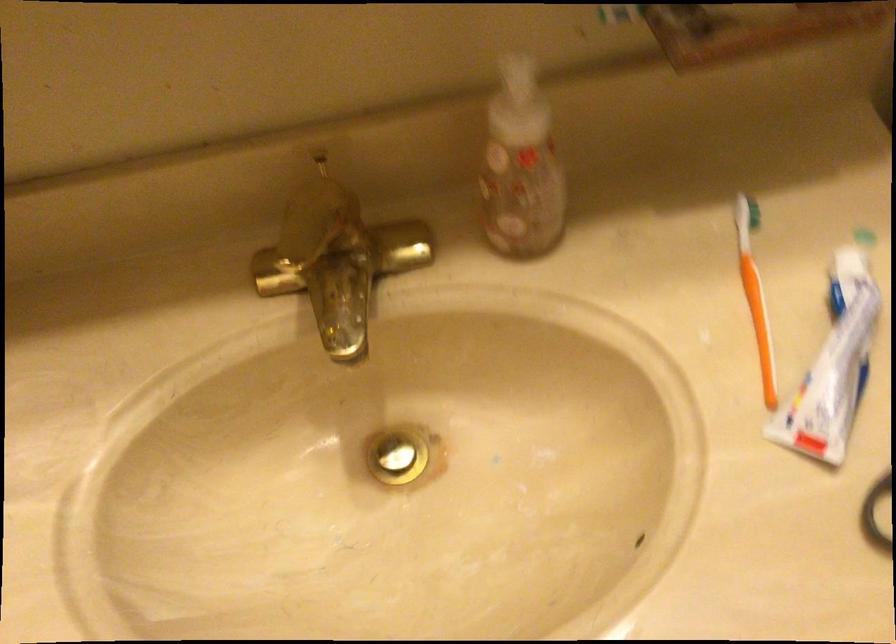
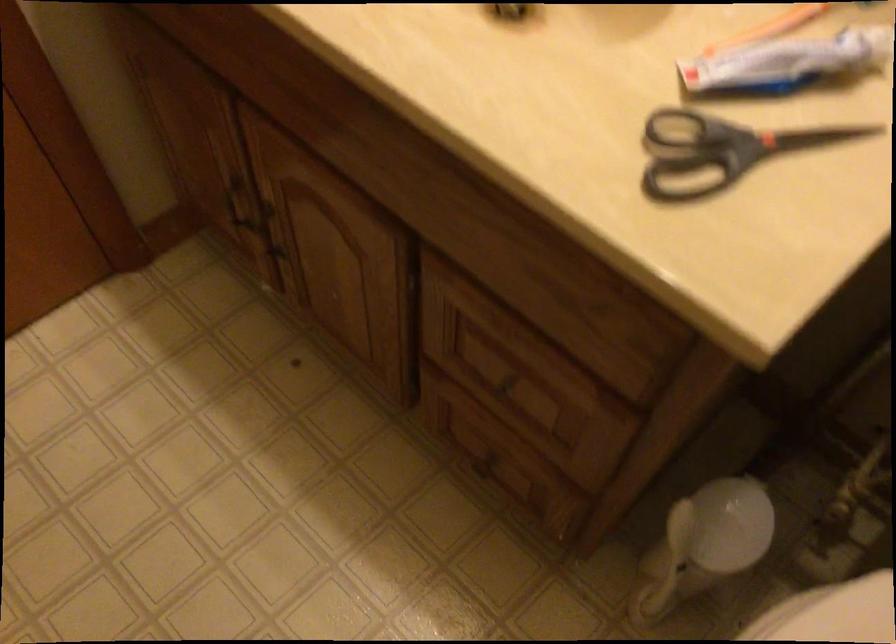
Question: Based on the continuous images, in which direction is the camera rotating? Reply with the corresponding letter.

Choices:
 (A) Left
 (B) Right
 (C) Up
 (D) Down

Answer: (A)